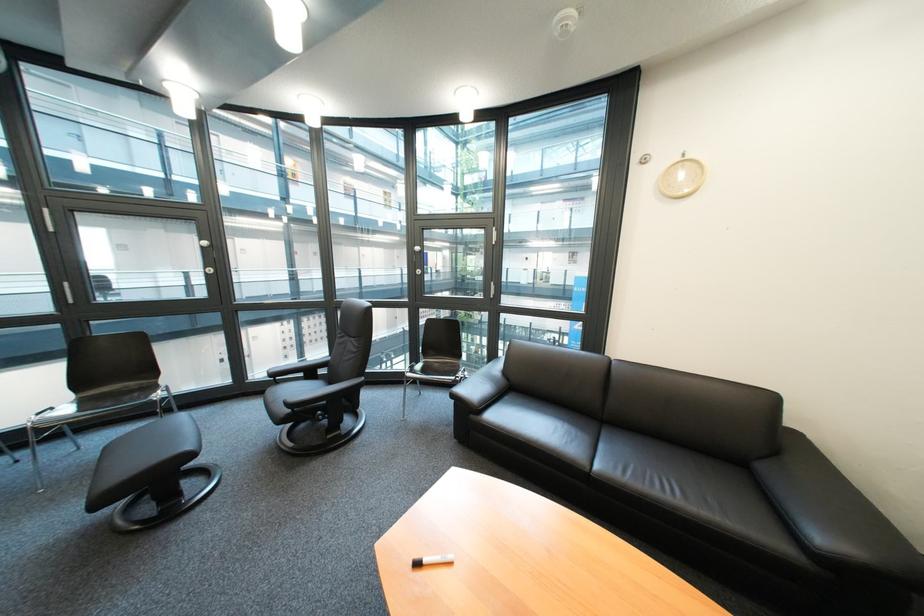
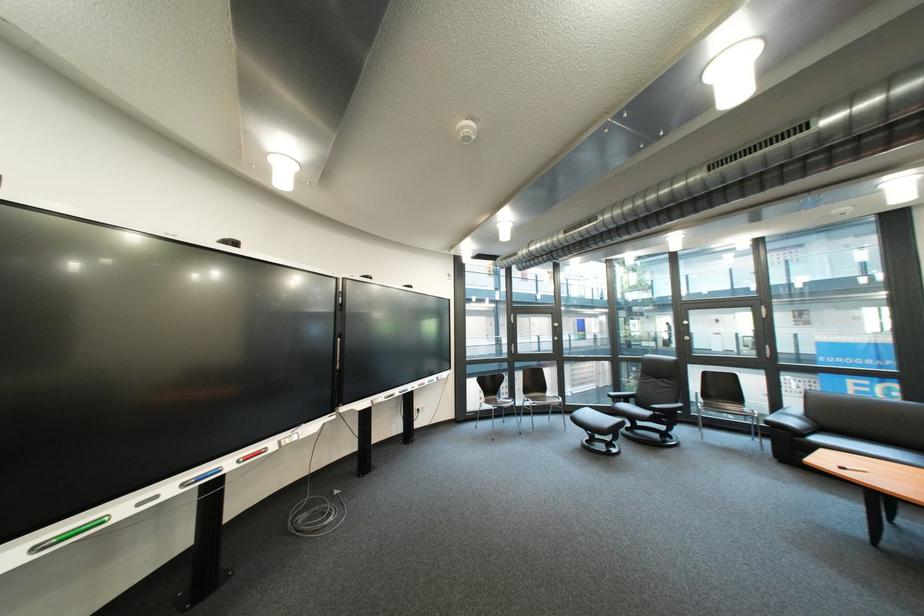
Locate, in the second image, the point that corresponds to (31,464) in the first image.

(517, 424)